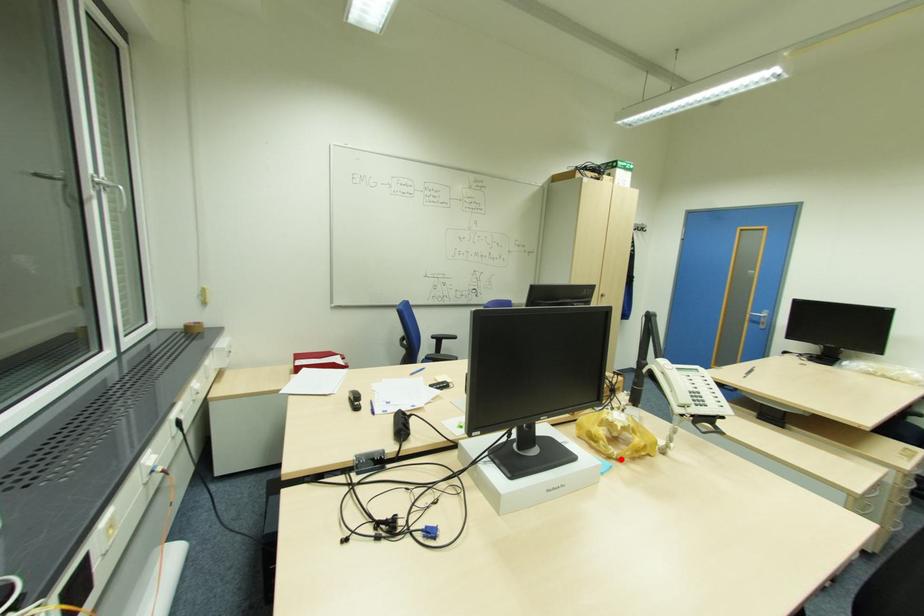
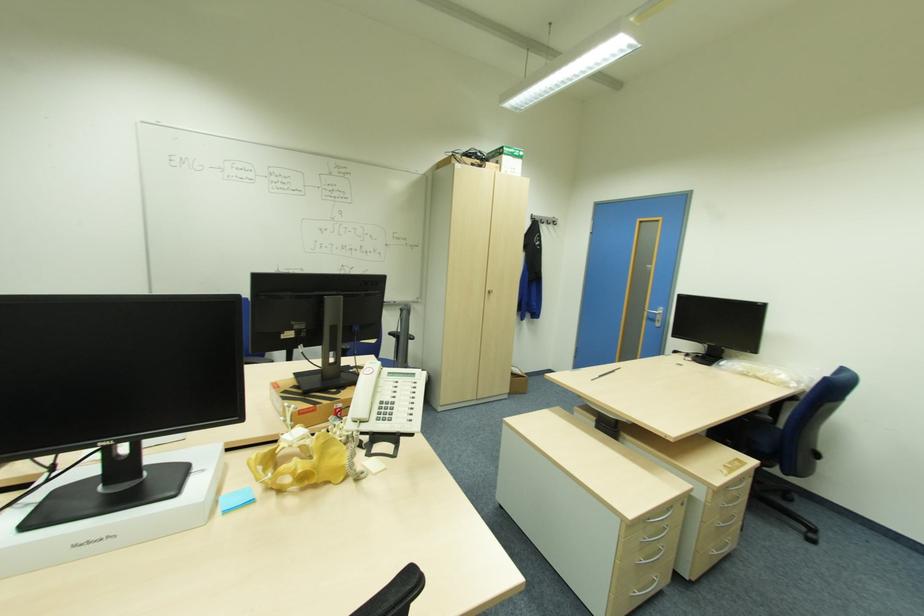
Locate, in the second image, the point that corresponds to the highlighted location in the first image.

(283, 490)